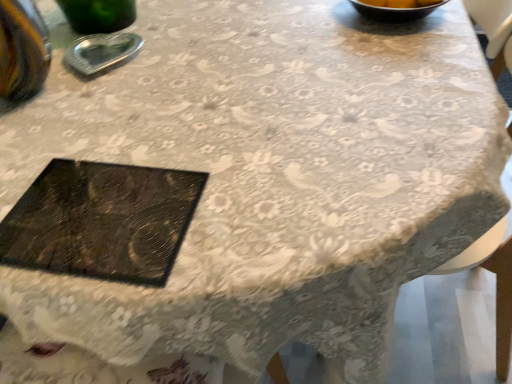
Question: Considering the relative positions of metallic silver ashtray at upper left and black textured tray at center in the image provided, is metallic silver ashtray at upper left in front of black textured tray at center?

Choices:
 (A) yes
 (B) no

Answer: (B)

Question: Is metallic silver ashtray at upper left completely or partially outside of black textured tray at center?

Choices:
 (A) no
 (B) yes

Answer: (B)

Question: From a real-world perspective, is metallic silver ashtray at upper left positioned over black textured tray at center based on gravity?

Choices:
 (A) yes
 (B) no

Answer: (A)

Question: Can you confirm if metallic silver ashtray at upper left is positioned to the right of black textured tray at center?

Choices:
 (A) no
 (B) yes

Answer: (A)

Question: Considering the relative sizes of metallic silver ashtray at upper left and black textured tray at center in the image provided, is metallic silver ashtray at upper left thinner than black textured tray at center?

Choices:
 (A) yes
 (B) no

Answer: (A)

Question: Considering the relative sizes of metallic silver ashtray at upper left and black textured tray at center in the image provided, is metallic silver ashtray at upper left taller than black textured tray at center?

Choices:
 (A) yes
 (B) no

Answer: (A)

Question: Does black textured tray at center have a greater width compared to metallic silver ashtray at upper left?

Choices:
 (A) yes
 (B) no

Answer: (A)

Question: From a real-world perspective, is black textured tray at center on metallic silver ashtray at upper left?

Choices:
 (A) no
 (B) yes

Answer: (A)

Question: Considering the relative positions of black textured tray at center and metallic silver ashtray at upper left in the image provided, is black textured tray at center behind metallic silver ashtray at upper left?

Choices:
 (A) yes
 (B) no

Answer: (B)

Question: Could you tell me if black textured tray at center is facing metallic silver ashtray at upper left?

Choices:
 (A) no
 (B) yes

Answer: (B)

Question: From the image's perspective, is black textured tray at center beneath metallic silver ashtray at upper left?

Choices:
 (A) no
 (B) yes

Answer: (B)

Question: Is black textured tray at center far away from metallic silver ashtray at upper left?

Choices:
 (A) no
 (B) yes

Answer: (A)

Question: Considering the relative positions of metallic silver ashtray at upper left and black textured tray at center in the image provided, is metallic silver ashtray at upper left to the left or to the right of black textured tray at center?

Choices:
 (A) right
 (B) left

Answer: (B)